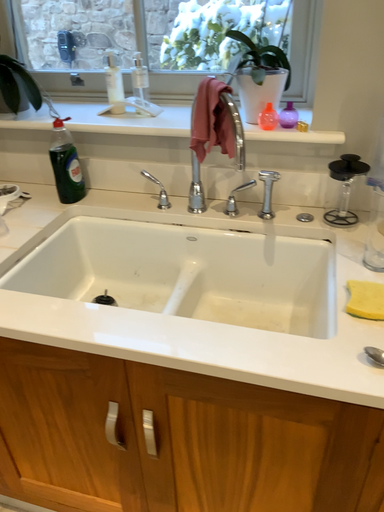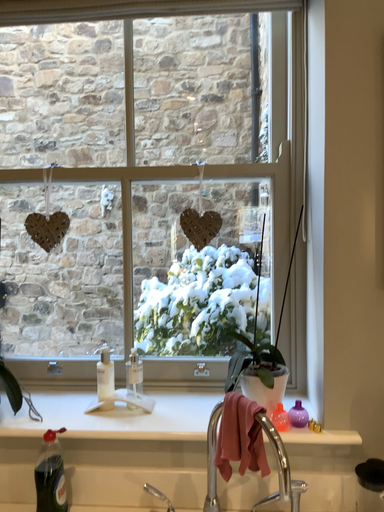
Question: Which way did the camera rotate in the video?

Choices:
 (A) rotated downward
 (B) rotated upward

Answer: (B)